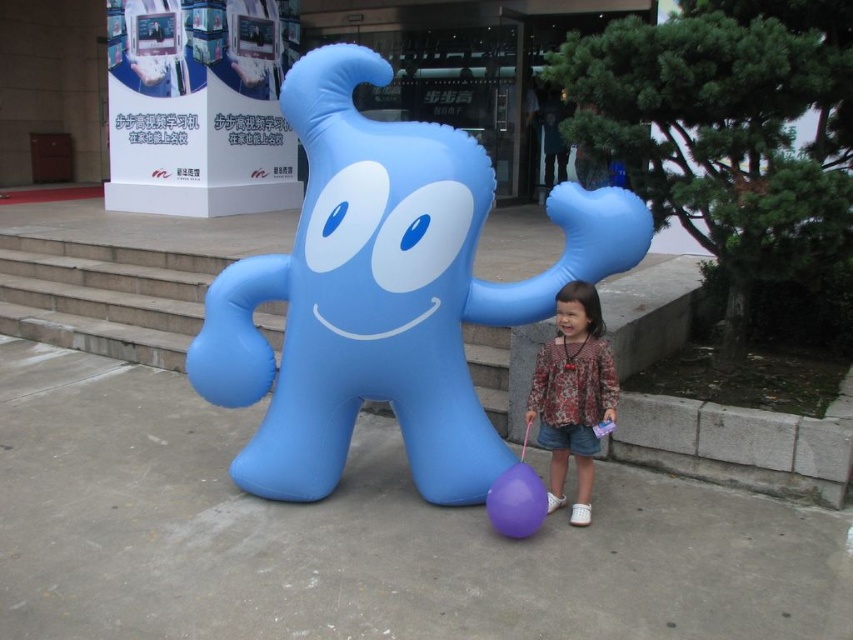
Is matte blue inflatable at center to the left of floral fabric dress at lower right from the viewer's perspective?

Correct, you'll find matte blue inflatable at center to the left of floral fabric dress at lower right.

The height and width of the screenshot is (640, 853). Identify the location of matte blue inflatable at center. (384, 292).

Does floral fabric dress at lower right lie behind purple rubber balloon at lower center?

Yes, floral fabric dress at lower right is behind purple rubber balloon at lower center.

Does floral fabric dress at lower right have a lesser height compared to purple rubber balloon at lower center?

No, floral fabric dress at lower right is not shorter than purple rubber balloon at lower center.

Is point (599, 381) in front of point (488, 515)?

No, (599, 381) is behind (488, 515).

The width and height of the screenshot is (853, 640). I want to click on floral fabric dress at lower right, so click(x=573, y=394).

Looking at this image, can you confirm if matte blue inflatable at center is shorter than purple rubber balloon at lower center?

No, matte blue inflatable at center is not shorter than purple rubber balloon at lower center.

Who is positioned more to the right, matte blue inflatable at center or purple rubber balloon at lower center?

From the viewer's perspective, purple rubber balloon at lower center appears more on the right side.

This screenshot has width=853, height=640. Find the location of `matte blue inflatable at center`. matte blue inflatable at center is located at coordinates (384, 292).

Where is `matte blue inflatable at center`? This screenshot has height=640, width=853. matte blue inflatable at center is located at coordinates (384, 292).